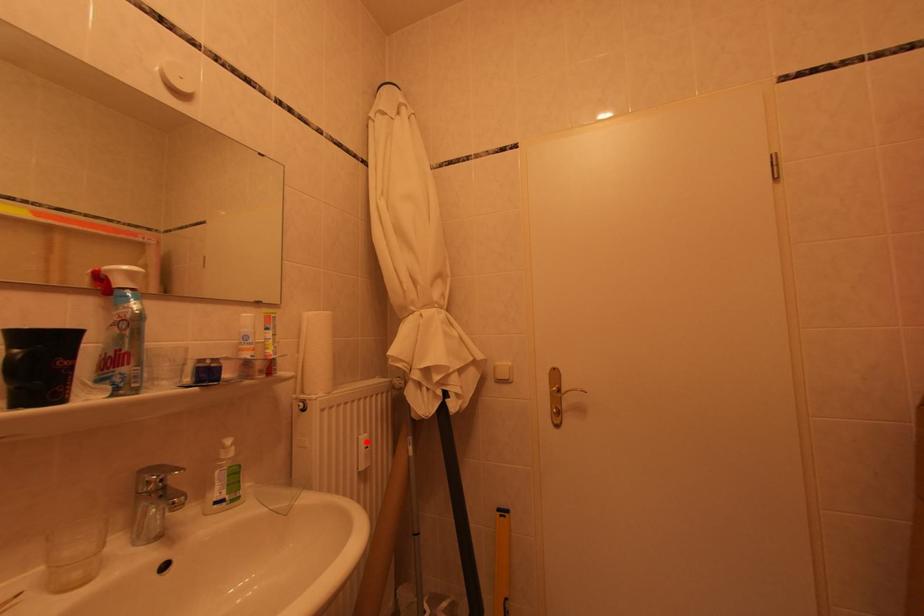
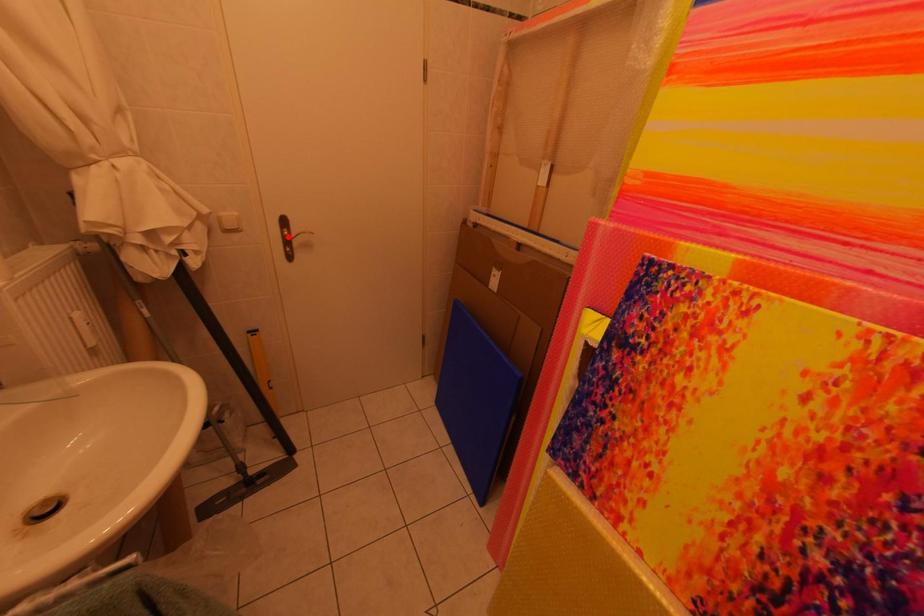
I am providing you with two images of the same scene from different viewpoints. A red point is marked on the first image and another point is marked on the second image. Is the marked point in image1 the same physical position as the marked point in image2?

No